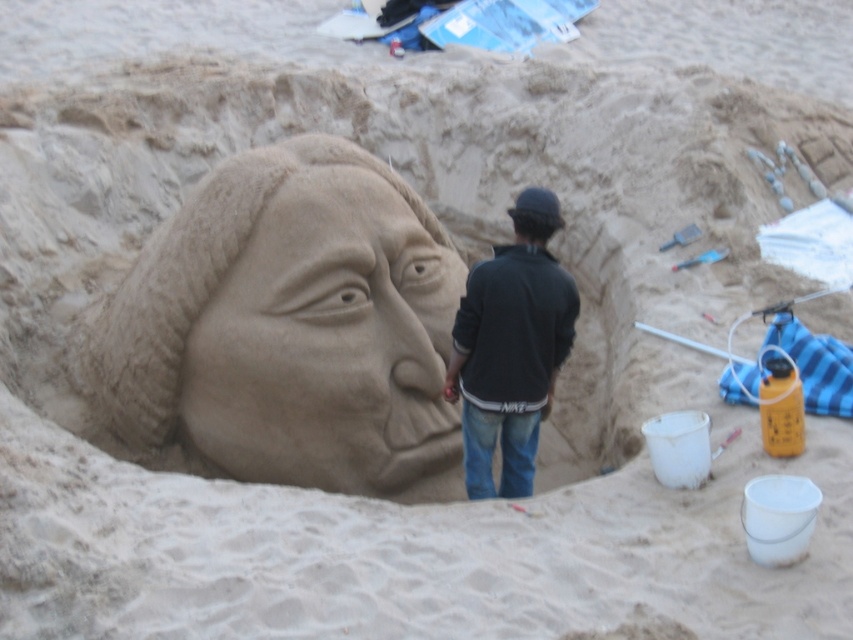
You are a photographer at the beach and want to capture both the black cotton jacket at center and the matte brown sand sculpture at center in a single frame. Given that the jacket is larger than the sculpture, which object should you position closer to the camera to ensure both appear balanced in size in your photo?

To balance the sizes in the photo, position the matte brown sand sculpture at center closer to the camera since the black cotton jacket at center is larger in real life. This adjustment will make both appear similar in size in the photo.

You are a photographer at the beach and want to capture the smooth sand sculpture at center and the black cotton jacket at center in the same frame. Based on their positions, which object is located to the left of the other?

The smooth sand sculpture at center is positioned on the left side of the black cotton jacket at center, so the sand sculpture is to the left of the jacket.

You are a visitor at the beach and want to take a photo of the smooth sand sculpture at center and the matte brown sand sculpture at center. Which sculpture should you focus on to capture the one that stands out more due to its height?

The smooth sand sculpture at center is much taller than the matte brown sand sculpture at center, so focusing on the smooth sand sculpture at center will capture the one that stands out more due to its height.